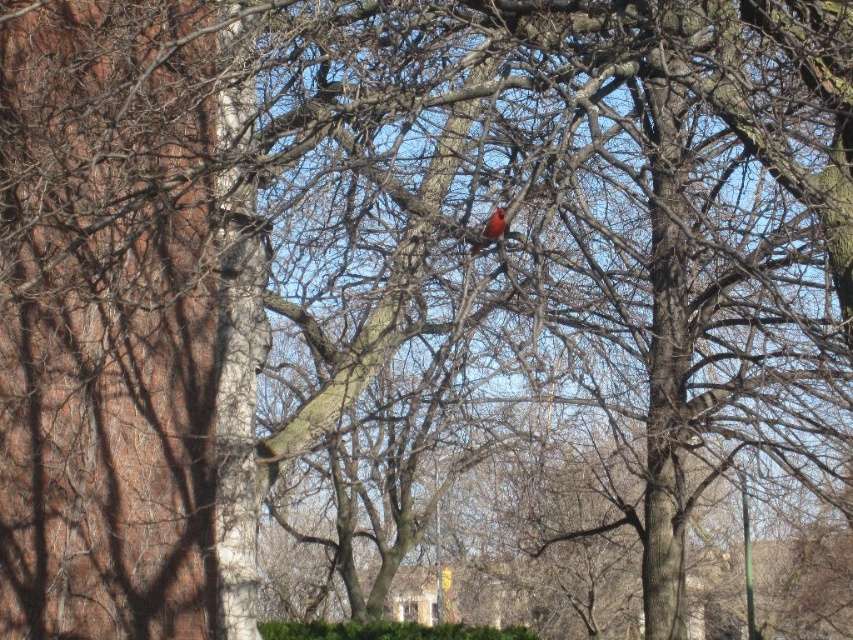
You are a small bird trying to find shelter from the rain. You see a green leafy hedge at lower center and a bright red feathers at center. Which one would provide better protection from the rain?

The green leafy hedge at lower center would provide better protection from the rain because it has a larger size compared to the bright red feathers at center.

Consider the image. You are standing in a garden and see a point marked at coordinates [387,630]. Based on the scene description, what object is this point located on?

The point at coordinates [387,630] is located on the green leafy hedge at lower center.